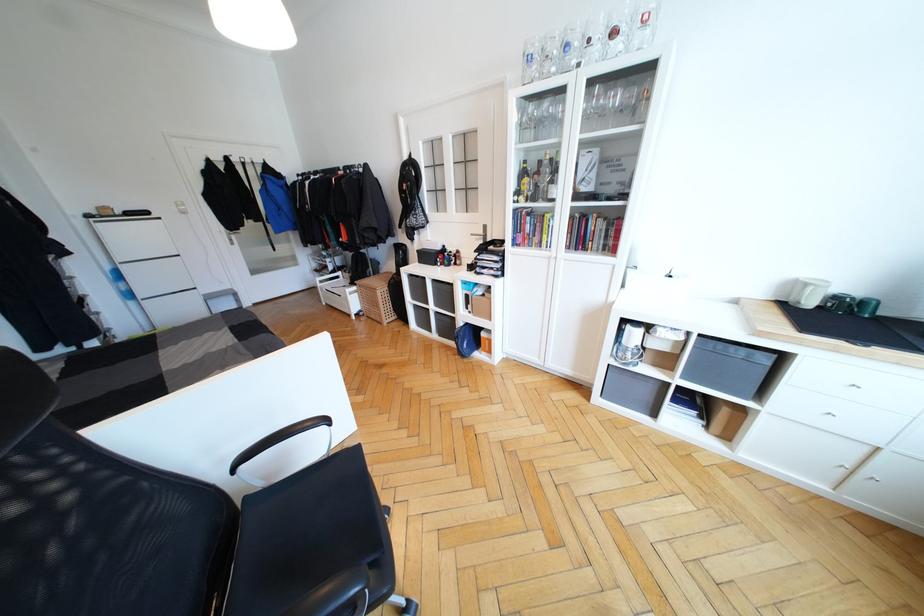
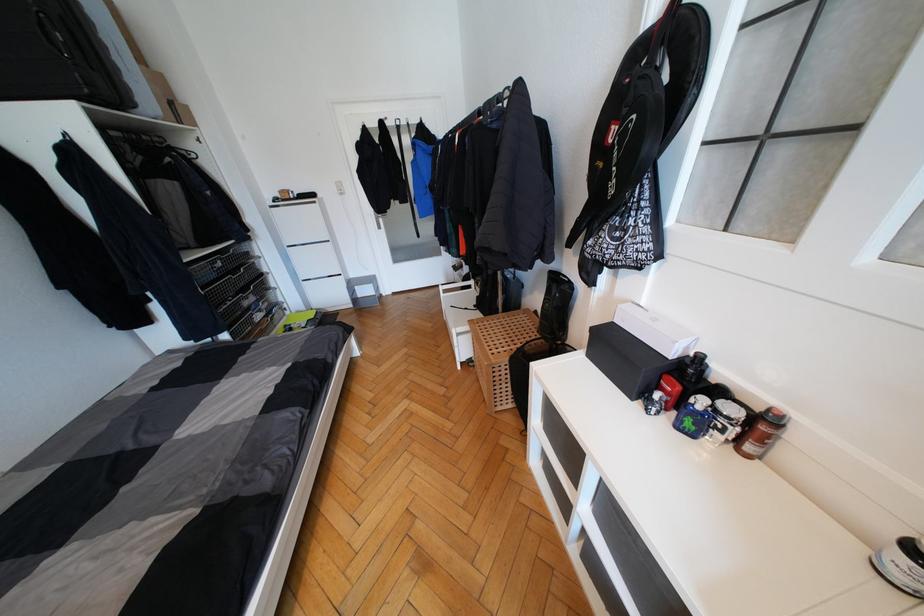
Locate, in the second image, the point that corresponds to the point at 450,264 in the first image.

(691, 426)